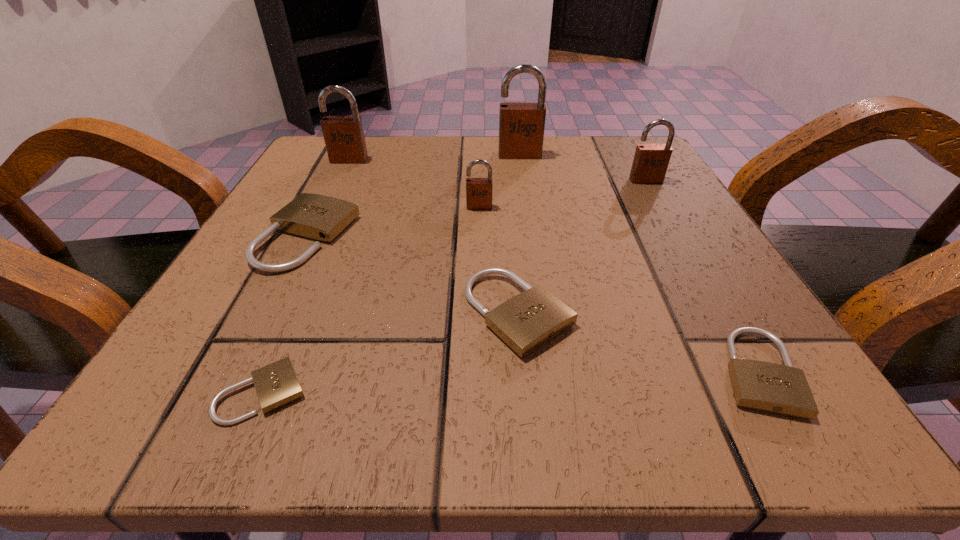
At what (x,y) coordinates should I click in order to perform the action: click on beige padlock identified as the closest to the second nearest brown padlock. Please return your answer as a coordinate pair (x, y). The height and width of the screenshot is (540, 960). Looking at the image, I should click on point(526,322).

The width and height of the screenshot is (960, 540). What are the coordinates of `vacant space that satisfies the following two spatial constraints: 1. on the front-facing side of the seventh tallest object; 2. on the right side of the nearest brown padlock` in the screenshot? It's located at (479, 372).

I want to click on vacant area that satisfies the following two spatial constraints: 1. on the front-facing side of the third smallest beige padlock; 2. on the left side of the smallest brown padlock, so click(479, 313).

Where is `free space that satisfies the following two spatial constraints: 1. on the front-facing side of the second tallest padlock; 2. on the left side of the third beige padlock from left to right`? free space that satisfies the following two spatial constraints: 1. on the front-facing side of the second tallest padlock; 2. on the left side of the third beige padlock from left to right is located at coordinates (275, 313).

You are a GUI agent. You are given a task and a screenshot of the screen. Output one action in this format:
    pyautogui.click(x=<x>, y=<y>)
    Task: Click on the free region that satisfies the following two spatial constraints: 1. on the front-facing side of the tallest padlock; 2. on the right side of the seventh tallest padlock
    The width and height of the screenshot is (960, 540).
    Given the screenshot: What is the action you would take?
    pyautogui.click(x=553, y=372)

You are a GUI agent. You are given a task and a screenshot of the screen. Output one action in this format:
    pyautogui.click(x=<x>, y=<y>)
    Task: Click on the vacant point that satisfies the following two spatial constraints: 1. on the front-facing side of the leftmost brown padlock; 2. on the right side of the third shortest object
    The image size is (960, 540).
    Given the screenshot: What is the action you would take?
    pyautogui.click(x=275, y=313)